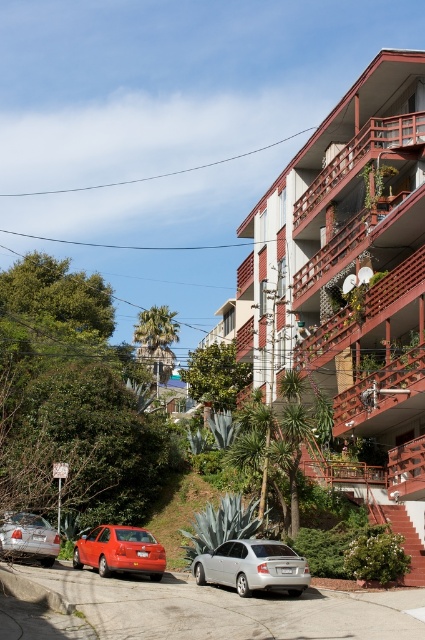
You are a delivery person trying to park your van between the wooden balcony at upper right and the shiny red sedan at lower left. Can you fit your van there if your van is 4 meters wide?

The wooden balcony at upper right is larger than the shiny red sedan at lower left, but the description does not provide specific measurements of their sizes or the space between them. Therefore, it is unclear if the van can fit in that area.

Consider the image. You are a delivery person standing at the entrance of the apartment building on the right. You need to deliver a package to the shiny red sedan at lower left and the silver metallic sedan at lower left. The delivery robot you are using has a maximum load capacity of 15 kilograms. The distance between the two sedans is 10.63 feet. If you start from the building, which sedan should you deliver to first to minimize the total distance traveled?

You should deliver to the shiny red sedan at lower left first because it is closer to the apartment building on the right than the silver metallic sedan at lower left. After delivering there, you can proceed to the silver metallic sedan at lower left, resulting in a shorter total distance compared to the reverse route.